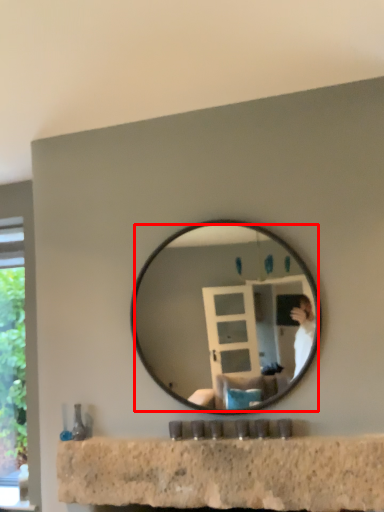
Question: From the image's perspective, what is the correct spatial relationship of mirror (annotated by the red box) in relation to counter top?

Choices:
 (A) below
 (B) above

Answer: (B)